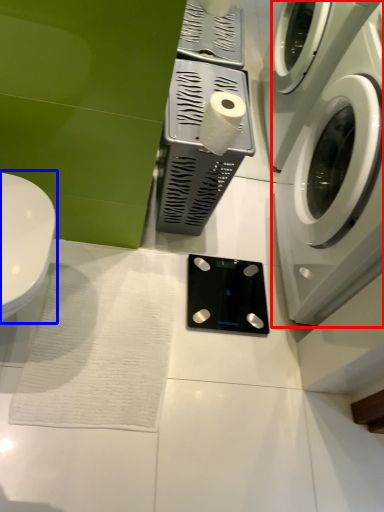
Question: Which object appears closest to the camera in this image, washing machine (highlighted by a red box) or toilet (highlighted by a blue box)?

Choices:
 (A) washing machine
 (B) toilet

Answer: (A)